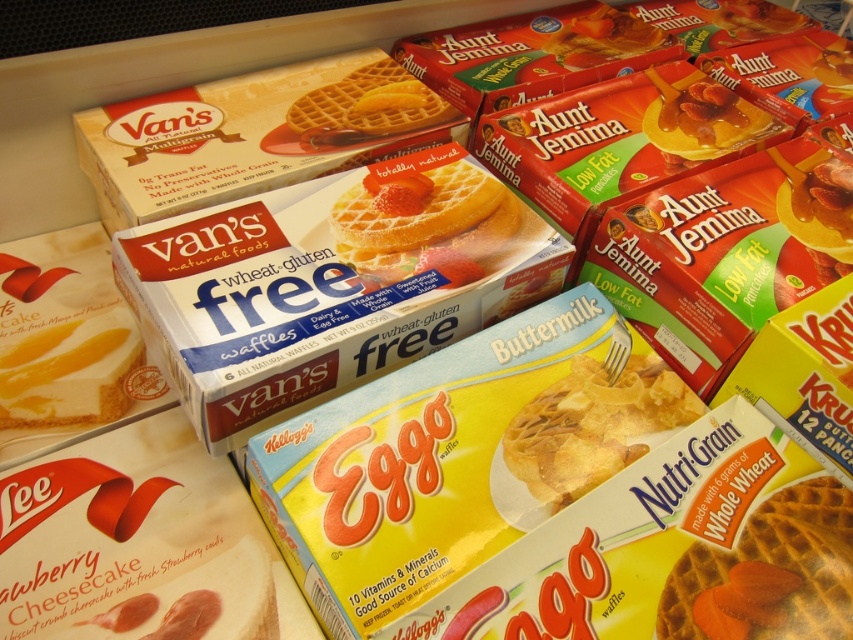
Question: Which of these objects is positioned farthest from the yellow matte waffle at center?

Choices:
 (A) whole wheat waffle at center
 (B) matte cardboard waffle at center

Answer: (B)

Question: Does whole wheat waffle at center lie in front of matte cardboard waffle at center?

Choices:
 (A) no
 (B) yes

Answer: (B)

Question: Can you confirm if whole wheat waffle at center is positioned below yellow matte waffle at center?

Choices:
 (A) yes
 (B) no

Answer: (A)

Question: Based on their relative distances, which object is farther from the whole wheat waffle at center?

Choices:
 (A) yellow matte waffle at center
 (B) totally natural yellow waffle at center

Answer: (B)

Question: Which object appears closest to the camera in this image?

Choices:
 (A) yellow matte waffle at center
 (B) whole wheat waffle at center
 (C) totally natural yellow waffle at center
 (D) matte cardboard waffle at center

Answer: (B)

Question: Does matte cardboard waffle at center appear on the right side of totally natural yellow waffle at center?

Choices:
 (A) no
 (B) yes

Answer: (A)